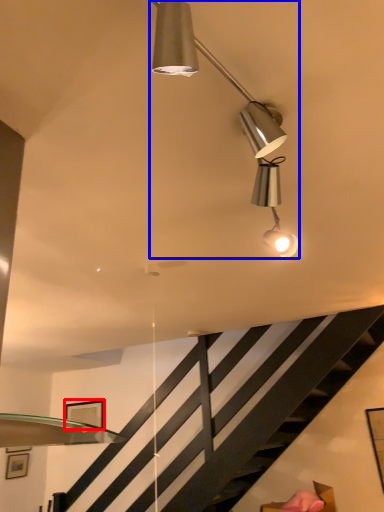
Question: Among these objects, which one is nearest to the camera, picture frame (highlighted by a red box) or lamp (highlighted by a blue box)?

Choices:
 (A) picture frame
 (B) lamp

Answer: (B)